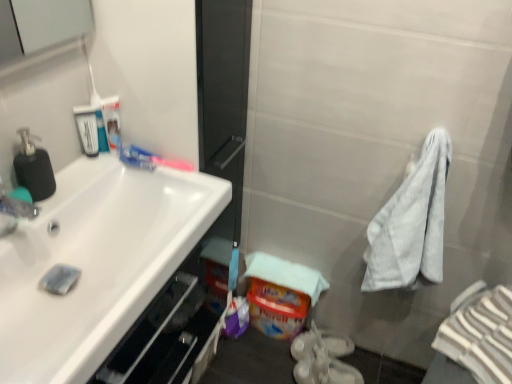
Where is `free space that is in between clear plastic bottle at upper left, which is the first mouthwash from right to left, and matte black soap dispenser at left`? This screenshot has height=384, width=512. free space that is in between clear plastic bottle at upper left, which is the first mouthwash from right to left, and matte black soap dispenser at left is located at coordinates (x=86, y=172).